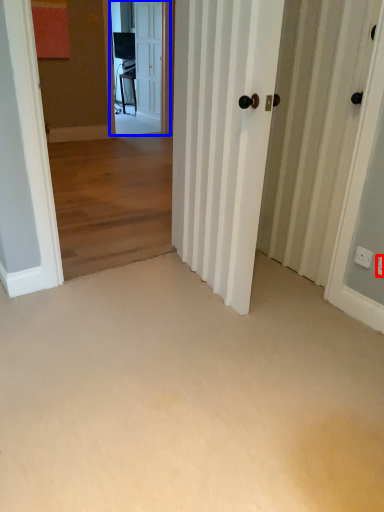
Question: Which object is further to the camera taking this photo, electric outlet (highlighted by a red box) or screen door (highlighted by a blue box)?

Choices:
 (A) electric outlet
 (B) screen door

Answer: (B)